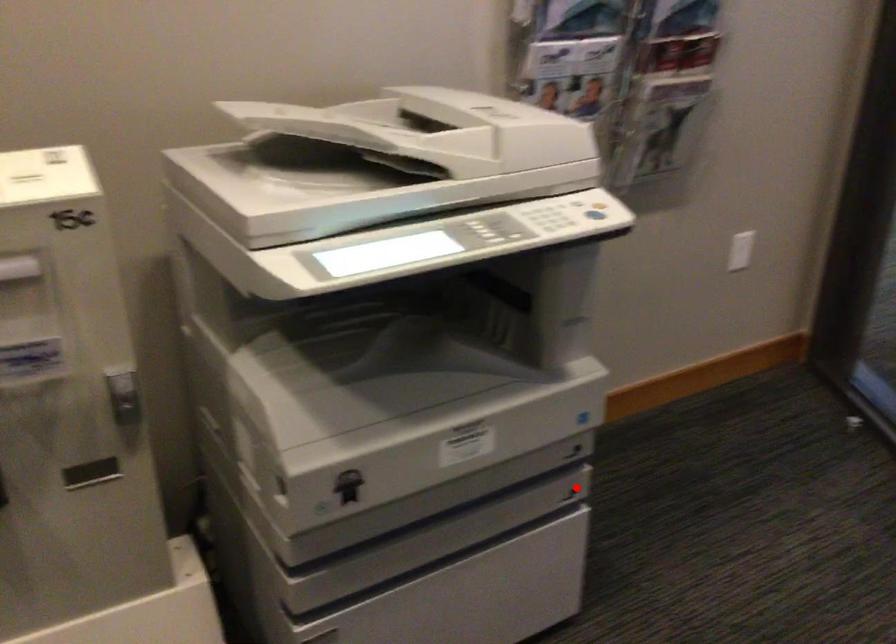
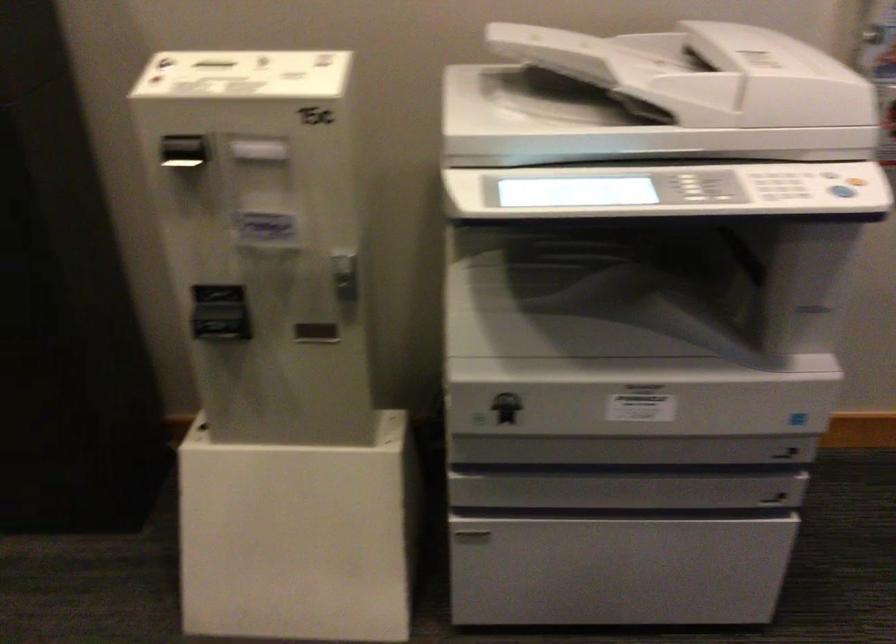
Find the pixel in the second image that matches the highlighted location in the first image.

(778, 493)